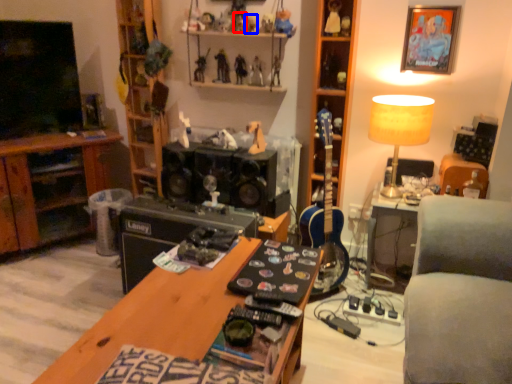
Question: Which object is further to the camera taking this photo, toy (highlighted by a red box) or toy (highlighted by a blue box)?

Choices:
 (A) toy
 (B) toy

Answer: (B)